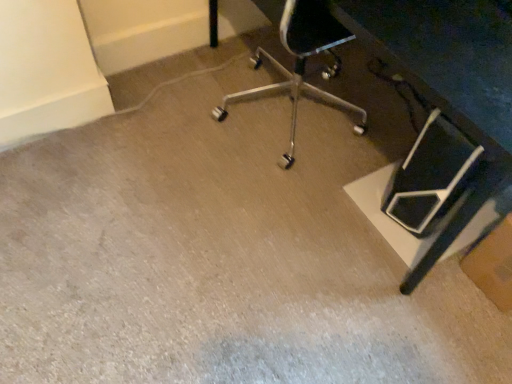
What do you see at coordinates (449, 79) in the screenshot? I see `black plastic table at center` at bounding box center [449, 79].

The width and height of the screenshot is (512, 384). What are the coordinates of `black plastic table at center` in the screenshot? It's located at (449, 79).

Describe the element at coordinates (493, 264) in the screenshot. This screenshot has width=512, height=384. I see `brown cardboard box at lower right` at that location.

At what (x,y) coordinates should I click in order to perform the action: click on brown cardboard box at lower right. Please return your answer as a coordinate pair (x, y). Looking at the image, I should click on (493, 264).

This screenshot has width=512, height=384. In order to click on black plastic table at center in this screenshot , I will do `click(449, 79)`.

Consider the image. Between brown cardboard box at lower right and black plastic table at center, which one appears on the right side from the viewer's perspective?

brown cardboard box at lower right is more to the right.

Relative to black plastic table at center, is brown cardboard box at lower right in front or behind?

Visually, brown cardboard box at lower right is located behind black plastic table at center.

Which point is more distant from viewer, (492,267) or (474,5)?

Positioned behind is point (492,267).

From the image's perspective, who appears lower, brown cardboard box at lower right or black plastic table at center?

brown cardboard box at lower right, from the image's perspective.

Based on the photo, from a real-world perspective, which is physically above, brown cardboard box at lower right or black plastic table at center?

black plastic table at center.

Which object is thinner, brown cardboard box at lower right or black plastic table at center?

Thinner between the two is brown cardboard box at lower right.

Is brown cardboard box at lower right taller or shorter than black plastic table at center?

Clearly, brown cardboard box at lower right is shorter compared to black plastic table at center.

Between brown cardboard box at lower right and black plastic table at center, which one has larger size?

black plastic table at center is bigger.

Can we say brown cardboard box at lower right lies outside black plastic table at center?

brown cardboard box at lower right is positioned outside black plastic table at center.

Can you see brown cardboard box at lower right touching black plastic table at center?

There is a gap between brown cardboard box at lower right and black plastic table at center.

Is brown cardboard box at lower right oriented towards black plastic table at center?

No, brown cardboard box at lower right is not aimed at black plastic table at center.

What's the angular difference between brown cardboard box at lower right and black plastic table at center's facing directions?

There is a 2.94-degree angle between the facing directions of brown cardboard box at lower right and black plastic table at center.

Identify the location of table located above the brown cardboard box at lower right (from the image's perspective). This screenshot has height=384, width=512. (449, 79).

Considering the positions of objects black plastic table at center and brown cardboard box at lower right in the image provided, who is more to the left, black plastic table at center or brown cardboard box at lower right?

Positioned to the left is black plastic table at center.

Which object is closer to the camera taking this photo, black plastic table at center or brown cardboard box at lower right?

Positioned in front is black plastic table at center.

Is point (498, 140) farther from camera compared to point (468, 264)?

No, (498, 140) is in front of (468, 264).

From the picture: From the image's perspective, is black plastic table at center located above or below brown cardboard box at lower right?

black plastic table at center is situated higher than brown cardboard box at lower right in the image.

In the scene shown: From a real-world perspective, between black plastic table at center and brown cardboard box at lower right, who is vertically higher?

black plastic table at center.

Considering the relative sizes of black plastic table at center and brown cardboard box at lower right in the image provided, is black plastic table at center thinner than brown cardboard box at lower right?

Incorrect, the width of black plastic table at center is not less than that of brown cardboard box at lower right.

Which of these two, black plastic table at center or brown cardboard box at lower right, stands shorter?

With less height is brown cardboard box at lower right.

Considering the sizes of black plastic table at center and brown cardboard box at lower right in the image, is black plastic table at center bigger or smaller than brown cardboard box at lower right?

In the image, black plastic table at center appears to be larger than brown cardboard box at lower right.

Consider the image. Can brown cardboard box at lower right be found inside black plastic table at center?

No, brown cardboard box at lower right is not inside black plastic table at center.

Is black plastic table at center not near brown cardboard box at lower right?

No, black plastic table at center is in close proximity to brown cardboard box at lower right.

Is black plastic table at center positioned with its back to brown cardboard box at lower right?

No, black plastic table at center's orientation is not away from brown cardboard box at lower right.

How distant is black plastic table at center from brown cardboard box at lower right?

black plastic table at center and brown cardboard box at lower right are 39.60 centimeters apart from each other.

Find the location of `cardboard box below the black plastic table at center (from the image's perspective)`. cardboard box below the black plastic table at center (from the image's perspective) is located at coordinates (493, 264).

Where is `table above the brown cardboard box at lower right (from a real-world perspective)`? This screenshot has height=384, width=512. table above the brown cardboard box at lower right (from a real-world perspective) is located at coordinates (449, 79).

Find the location of a particular element. The image size is (512, 384). table that is in front of the brown cardboard box at lower right is located at coordinates (449, 79).